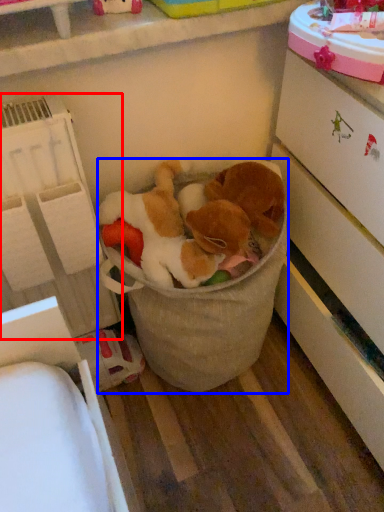
Question: Among these objects, which one is nearest to the camera, shelf (highlighted by a red box) or toy (highlighted by a blue box)?

Choices:
 (A) shelf
 (B) toy

Answer: (A)